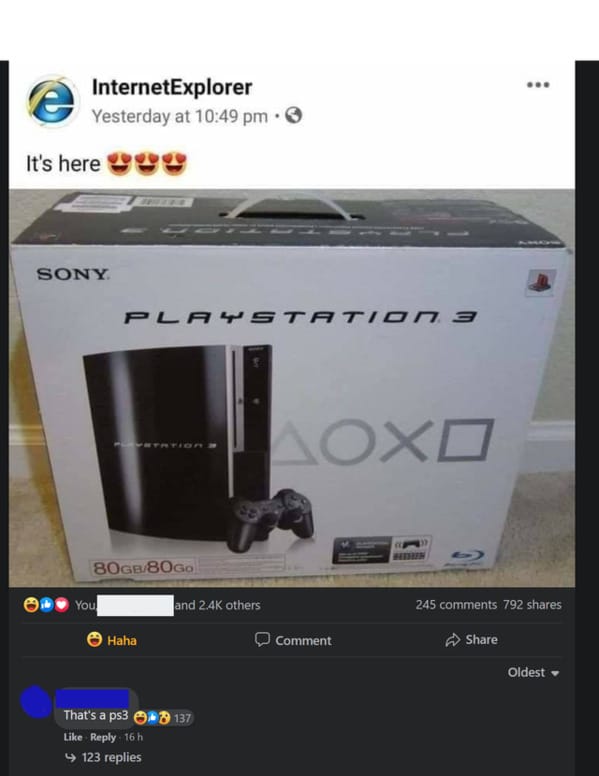
This screenshot has width=599, height=776. I want to click on the back wall, so (x=562, y=361), (x=18, y=406).